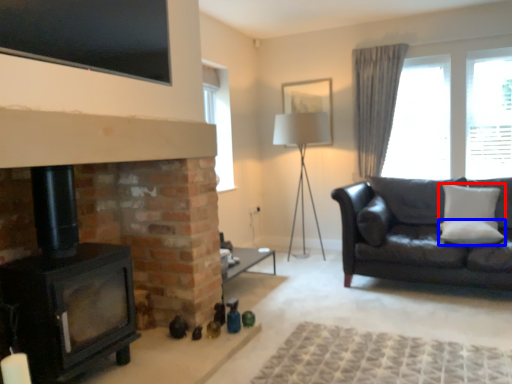
Question: Which of the following is the farthest to the observer, pillow (highlighted by a red box) or pillow (highlighted by a blue box)?

Choices:
 (A) pillow
 (B) pillow

Answer: (A)